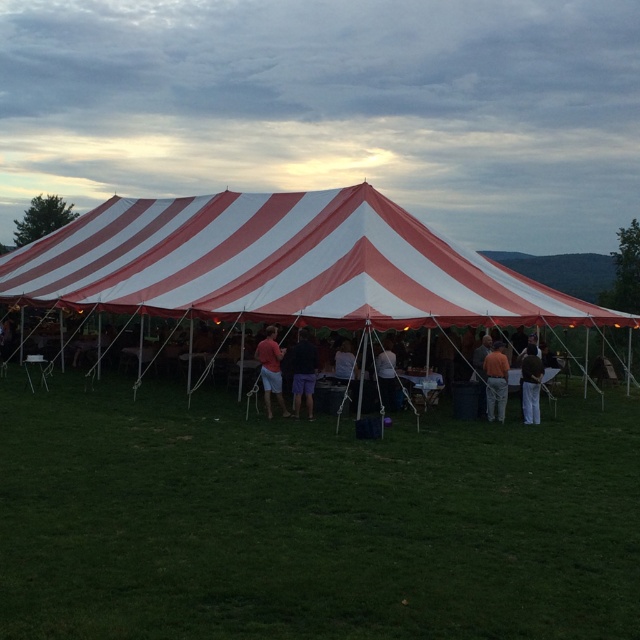
Which is in front, point (296, 397) or point (348, 365)?

Point (296, 397) is more forward.

Does point (298, 362) come in front of point (340, 362)?

Yes, point (298, 362) is closer to viewer.

Where is `black fabric at center`? black fabric at center is located at coordinates (304, 372).

Is black fabric at center below matte red shirt at center?

Yes.

Is black fabric at center positioned behind matte red shirt at center?

No.

Identify the location of black fabric at center. (304, 372).

Which is below, white striped tent at center or black fabric at center?

black fabric at center is lower down.

Can you confirm if white striped tent at center is positioned to the right of black fabric at center?

Incorrect, white striped tent at center is not on the right side of black fabric at center.

The width and height of the screenshot is (640, 640). What do you see at coordinates (280, 266) in the screenshot?
I see `white striped tent at center` at bounding box center [280, 266].

You are a GUI agent. You are given a task and a screenshot of the screen. Output one action in this format:
    pyautogui.click(x=<x>, y=<y>)
    Task: Click on the white striped tent at center
    The image size is (640, 640).
    Given the screenshot: What is the action you would take?
    pyautogui.click(x=280, y=266)